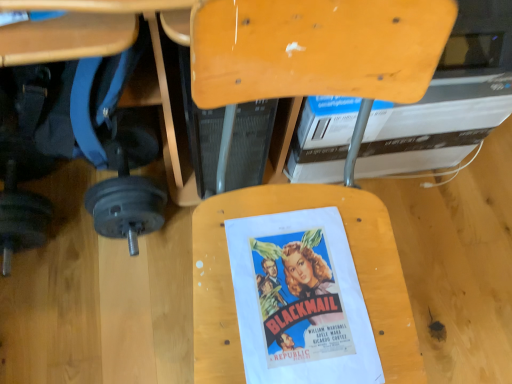
Question: Is matte paper movie poster at center wider or thinner than white cardboard book at upper center?

Choices:
 (A) thin
 (B) wide

Answer: (A)

Question: Is matte paper movie poster at center inside or outside of white cardboard book at upper center?

Choices:
 (A) inside
 (B) outside

Answer: (B)

Question: Estimate the real-world distances between objects in this image. Which object is farther from the wooden chair at center?

Choices:
 (A) white cardboard book at upper center
 (B) brushed metal dumbbell at lower left
 (C) matte paper movie poster at center

Answer: (B)

Question: Estimate the real-world distances between objects in this image. Which object is farther from the brushed metal dumbbell at lower left?

Choices:
 (A) wooden chair at center
 (B) white cardboard book at upper center
 (C) matte paper movie poster at center

Answer: (B)